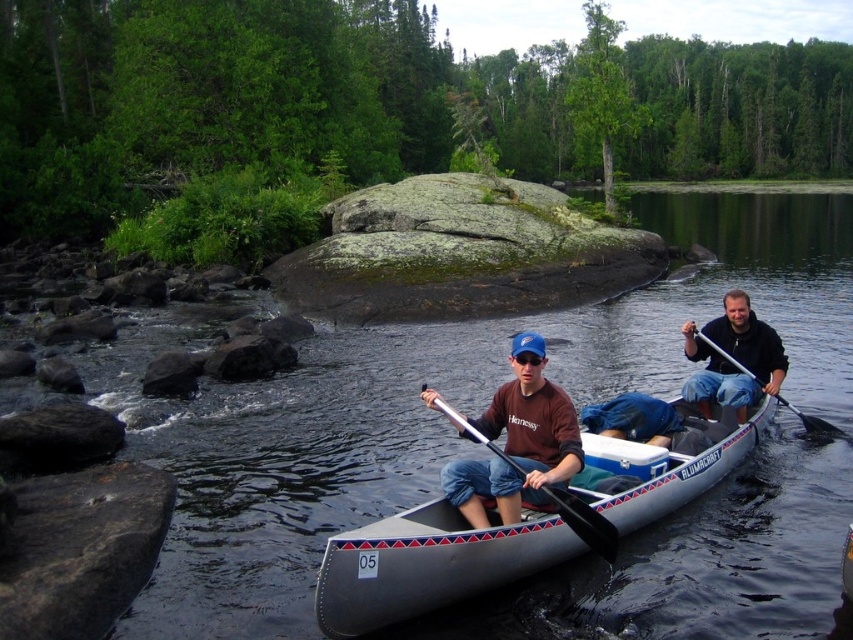
The height and width of the screenshot is (640, 853). Identify the location of clear water at center. (433, 412).

Who is lower down, clear water at center or silver metallic paddle at center?

silver metallic paddle at center is below.

Describe the element at coordinates (433, 412) in the screenshot. This screenshot has height=640, width=853. I see `clear water at center` at that location.

You are a GUI agent. You are given a task and a screenshot of the screen. Output one action in this format:
    pyautogui.click(x=<x>, y=<y>)
    Task: Click on the clear water at center
    
    Given the screenshot: What is the action you would take?
    pyautogui.click(x=433, y=412)

Can you confirm if gray rubber canoe at center is shorter than matte brown shirt at center?

Incorrect, gray rubber canoe at center's height does not fall short of matte brown shirt at center's.

Is gray rubber canoe at center taller than matte brown shirt at center?

Indeed, gray rubber canoe at center has a greater height compared to matte brown shirt at center.

Which is behind, point (758, 403) or point (759, 381)?

The point (758, 403) is behind.

I want to click on gray rubber canoe at center, so click(x=428, y=563).

The height and width of the screenshot is (640, 853). Identify the location of clear water at center. (433, 412).

Between point (363, 416) and point (740, 400), which one is positioned behind?

The point (363, 416) is more distant.

Between point (837, 282) and point (592, 413), which one is positioned in front?

Point (592, 413)

This screenshot has height=640, width=853. Find the location of `clear water at center`. clear water at center is located at coordinates (433, 412).